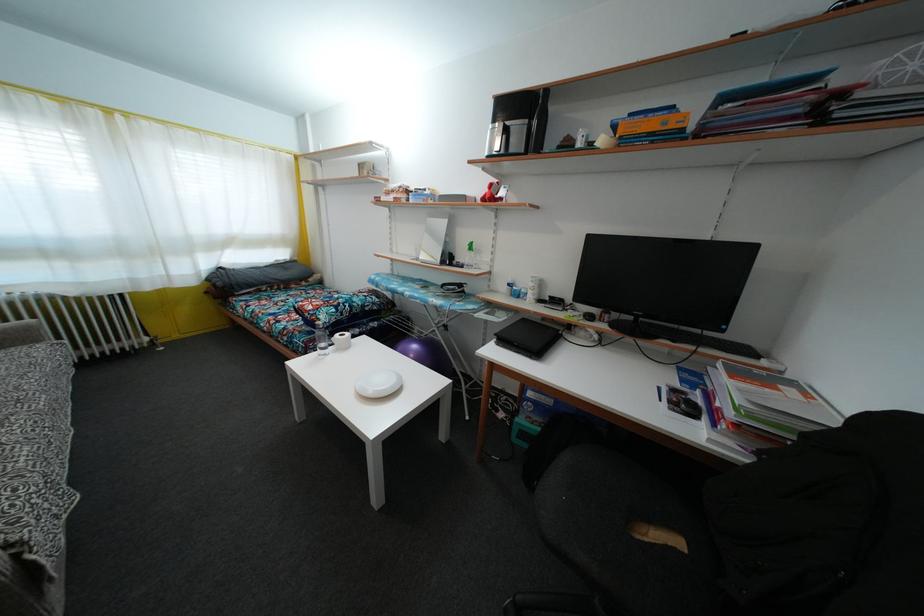
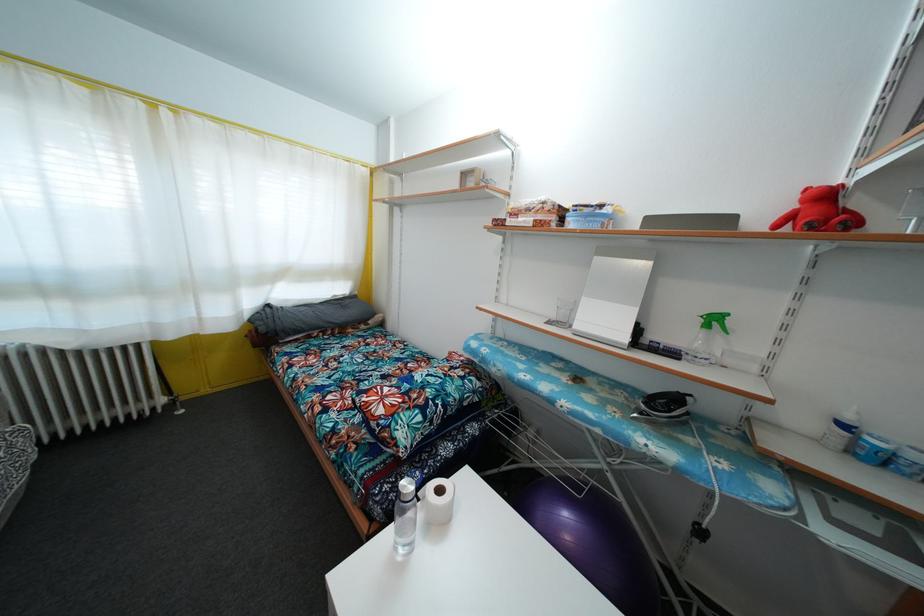
Locate, in the second image, the point that corresponds to point 448,334 in the first image.

(704, 540)